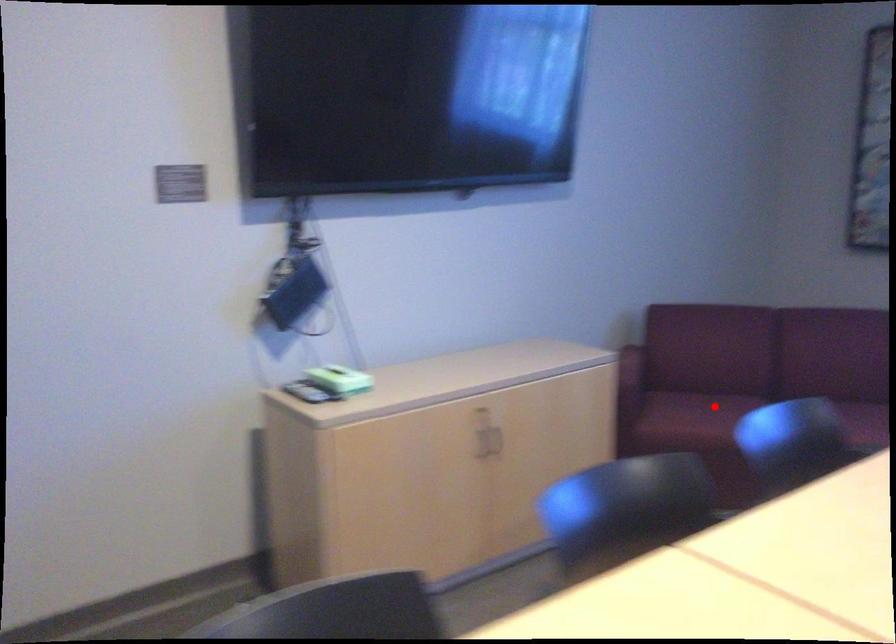
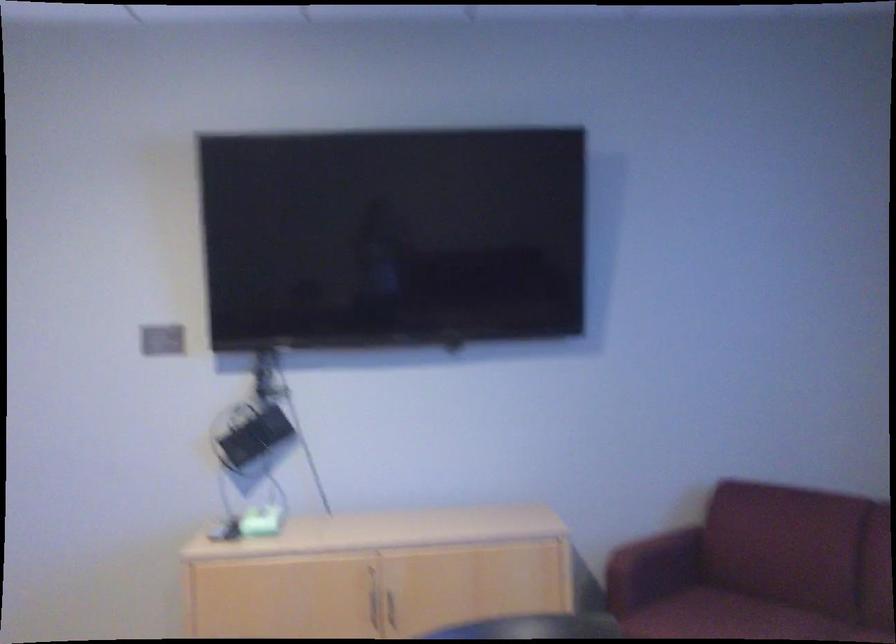
Question: I am providing you with two images of the same scene from different viewpoints. A red point is marked on the first image. Can you still see the location of the red point in image 2?

Choices:
 (A) Yes
 (B) No

Answer: (A)